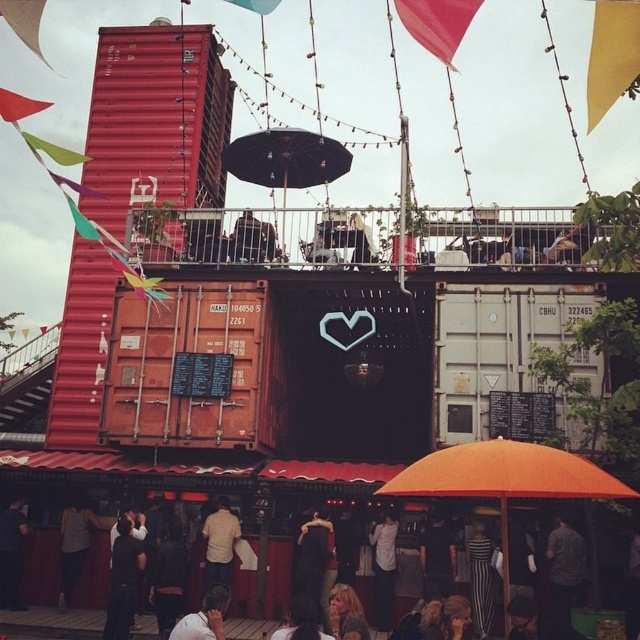
Does dark gray fabric jacket at lower left appear on the left side of smooth skin face at lower center?

Yes, dark gray fabric jacket at lower left is to the left of smooth skin face at lower center.

Is dark gray fabric jacket at lower left closer to camera compared to smooth skin face at lower center?

No, it is not.

Identify the location of dark gray fabric jacket at lower left. (124, 580).

At what (x,y) coordinates should I click in order to perform the action: click on dark gray fabric jacket at lower left. Please return your answer as a coordinate pair (x, y). This screenshot has width=640, height=640. Looking at the image, I should click on (124, 580).

This screenshot has height=640, width=640. Find the location of `black fabric umbrella at upper center`. black fabric umbrella at upper center is located at coordinates (285, 161).

What do you see at coordinates (285, 161) in the screenshot? This screenshot has height=640, width=640. I see `black fabric umbrella at upper center` at bounding box center [285, 161].

Does point (340, 145) lie in front of point (320, 605)?

No, (340, 145) is behind (320, 605).

The height and width of the screenshot is (640, 640). Identify the location of black fabric umbrella at upper center. (285, 161).

Is point (211, 544) closer to camera compared to point (372, 570)?

That is False.

Is point (209, 548) less distant than point (381, 561)?

No, (209, 548) is behind (381, 561).

Locate an element on the screen. This screenshot has width=640, height=640. light brown leather jacket at center is located at coordinates (220, 545).